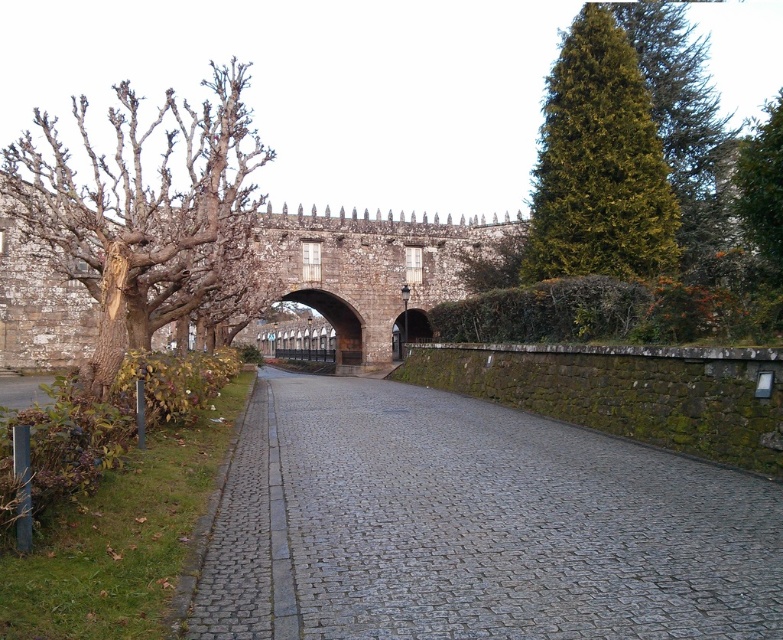
Question: Does gray cobblestone pavement at center come behind green leafy tree at upper right?

Choices:
 (A) no
 (B) yes

Answer: (A)

Question: Can you confirm if gray cobblestone pavement at center is smaller than bare wood tree at left?

Choices:
 (A) no
 (B) yes

Answer: (B)

Question: Considering the real-world distances, which object is closest to the green leafy tree at upper right?

Choices:
 (A) gray cobblestone pavement at center
 (B) green textured tree at upper right
 (C) bare wood tree at left

Answer: (B)

Question: Which of these objects is positioned closest to the green textured tree at upper right?

Choices:
 (A) gray cobblestone pavement at center
 (B) green leafy tree at upper right

Answer: (B)

Question: Does green textured tree at upper right have a greater width compared to green leafy tree at upper right?

Choices:
 (A) no
 (B) yes

Answer: (A)

Question: Which object is positioned farthest from the green textured tree at upper right?

Choices:
 (A) gray cobblestone pavement at center
 (B) green leafy tree at upper right

Answer: (A)